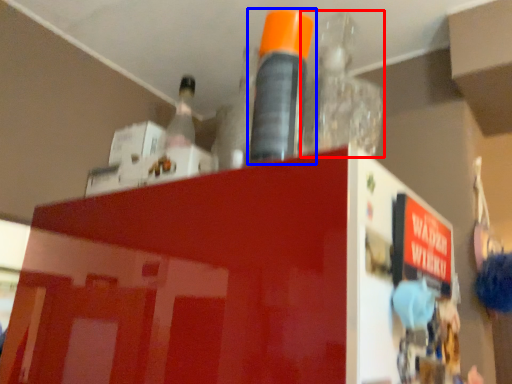
Question: Which object appears closest to the camera in this image, bottle (highlighted by a red box) or bottle (highlighted by a blue box)?

Choices:
 (A) bottle
 (B) bottle

Answer: (B)